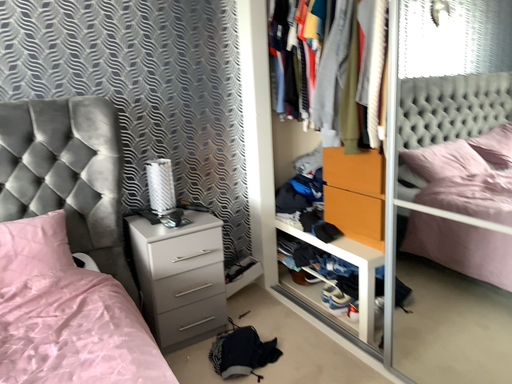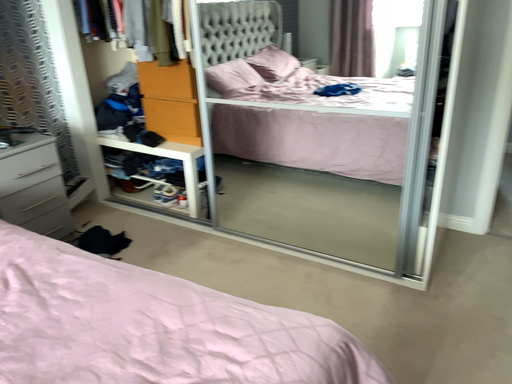
Question: How did the camera likely rotate when shooting the video?

Choices:
 (A) rotated downward
 (B) rotated upward

Answer: (A)